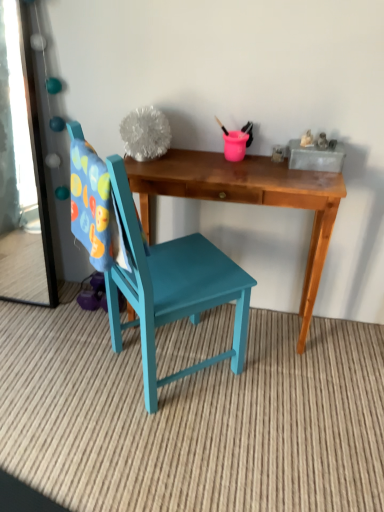
At what (x,y) coordinates should I click in order to perform the action: click on vacant point to the right of teal painted wood chair at center. Please return your answer as a coordinate pair (x, y). Looking at the image, I should click on (286, 393).